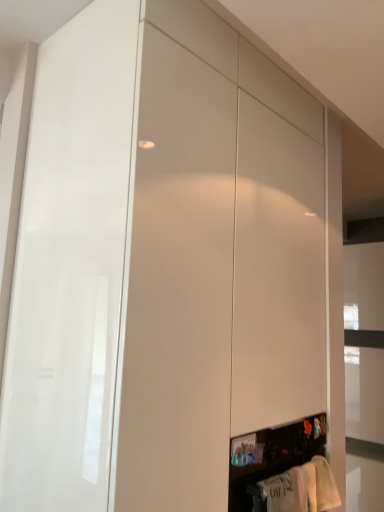
Locate an element on the screen. white cotton shirt at lower right, the first clothing positioned from the front is located at coordinates (286, 490).

Consider the image. Measure the distance between white cotton shirt at lower right, the 2th clothing when ordered from back to front, and camera.

The distance of white cotton shirt at lower right, the 2th clothing when ordered from back to front, from camera is 1.22 meters.

What do you see at coordinates (286, 490) in the screenshot? I see `white cotton shirt at lower right, the first clothing positioned from the front` at bounding box center [286, 490].

The height and width of the screenshot is (512, 384). What are the coordinates of `white cotton towel at lower right, which is the 1th clothing from back to front` in the screenshot? It's located at (325, 485).

The image size is (384, 512). What do you see at coordinates (325, 485) in the screenshot?
I see `white cotton towel at lower right, placed as the 1th clothing when sorted from right to left` at bounding box center [325, 485].

In order to face white cotton towel at lower right, acting as the 2th clothing starting from the left, should I rotate leftwards or rightwards?

Turn right by 16.484 degrees to look at white cotton towel at lower right, acting as the 2th clothing starting from the left.

The width and height of the screenshot is (384, 512). What are the coordinates of `white cotton shirt at lower right, the first clothing in the left-to-right sequence` in the screenshot? It's located at 286,490.

Does white cotton shirt at lower right, the 2th clothing when ordered from back to front, appear on the right side of white cotton towel at lower right, placed as the 1th clothing when sorted from right to left?

No, white cotton shirt at lower right, the 2th clothing when ordered from back to front, is not to the right of white cotton towel at lower right, placed as the 1th clothing when sorted from right to left.

Considering the positions of objects white cotton shirt at lower right, the first clothing positioned from the front, and white cotton towel at lower right, positioned as the 2th clothing in front-to-back order, in the image provided, who is in front, white cotton shirt at lower right, the first clothing positioned from the front, or white cotton towel at lower right, positioned as the 2th clothing in front-to-back order,?

white cotton shirt at lower right, the first clothing positioned from the front, is more forward.

Considering the positions of point (297, 499) and point (323, 481), is point (297, 499) closer or farther from the camera than point (323, 481)?

Point (297, 499) is closer to the camera than point (323, 481).

From the image's perspective, which is above, white cotton shirt at lower right, the 2th clothing when ordered from back to front, or white cotton towel at lower right, placed as the 1th clothing when sorted from right to left?

white cotton shirt at lower right, the 2th clothing when ordered from back to front, appears higher in the image.

From a real-world perspective, which object rests below the other?

white cotton shirt at lower right, the first clothing positioned from the front, from a real-world perspective.

Looking at their sizes, would you say white cotton shirt at lower right, the 2th clothing when ordered from back to front, is wider or thinner than white cotton towel at lower right, which is the 1th clothing from back to front?

In the image, white cotton shirt at lower right, the 2th clothing when ordered from back to front, appears to be wider than white cotton towel at lower right, which is the 1th clothing from back to front.

Does white cotton shirt at lower right, the first clothing in the left-to-right sequence, have a lesser height compared to white cotton towel at lower right, which is the 1th clothing from back to front?

No.

Between white cotton shirt at lower right, the 2th clothing when ordered from back to front, and white cotton towel at lower right, positioned as the 2th clothing in front-to-back order, which one has smaller size?

white cotton towel at lower right, positioned as the 2th clothing in front-to-back order.

Looking at this image, would you say white cotton shirt at lower right, the first clothing in the left-to-right sequence, contains white cotton towel at lower right, positioned as the 2th clothing in front-to-back order?

No, white cotton shirt at lower right, the first clothing in the left-to-right sequence, does not contain white cotton towel at lower right, positioned as the 2th clothing in front-to-back order.

Are white cotton shirt at lower right, which ranks as the second clothing in right-to-left order, and white cotton towel at lower right, which is the 1th clothing from back to front, beside each other?

No.

Is white cotton shirt at lower right, which ranks as the second clothing in right-to-left order, facing towards white cotton towel at lower right, which is the 1th clothing from back to front?

No, white cotton shirt at lower right, which ranks as the second clothing in right-to-left order, does not turn towards white cotton towel at lower right, which is the 1th clothing from back to front.

How different are the orientations of white cotton shirt at lower right, the first clothing positioned from the front, and white cotton towel at lower right, placed as the 1th clothing when sorted from right to left, in degrees?

white cotton shirt at lower right, the first clothing positioned from the front, and white cotton towel at lower right, placed as the 1th clothing when sorted from right to left, are facing 2.72 degrees away from each other.

Could you measure the distance between white cotton shirt at lower right, which ranks as the second clothing in right-to-left order, and white cotton towel at lower right, positioned as the 2th clothing in front-to-back order?

white cotton shirt at lower right, which ranks as the second clothing in right-to-left order, and white cotton towel at lower right, positioned as the 2th clothing in front-to-back order, are 8.95 inches apart from each other.

You are a GUI agent. You are given a task and a screenshot of the screen. Output one action in this format:
    pyautogui.click(x=<x>, y=<y>)
    Task: Click on the clothing to the left of white cotton towel at lower right, acting as the 2th clothing starting from the left
    
    Given the screenshot: What is the action you would take?
    pyautogui.click(x=286, y=490)

Considering the positions of objects white cotton towel at lower right, placed as the 1th clothing when sorted from right to left, and white cotton shirt at lower right, the 2th clothing when ordered from back to front, in the image provided, who is more to the right, white cotton towel at lower right, placed as the 1th clothing when sorted from right to left, or white cotton shirt at lower right, the 2th clothing when ordered from back to front,?

white cotton towel at lower right, placed as the 1th clothing when sorted from right to left, is more to the right.

Who is more distant, white cotton towel at lower right, which is the 1th clothing from back to front, or white cotton shirt at lower right, the 2th clothing when ordered from back to front?

white cotton towel at lower right, which is the 1th clothing from back to front.

Is point (323, 500) closer or farther from the camera than point (268, 500)?

Clearly, point (323, 500) is more distant from the camera than point (268, 500).

From the image's perspective, is white cotton towel at lower right, which is the 1th clothing from back to front, above or below white cotton shirt at lower right, the first clothing positioned from the front?

white cotton towel at lower right, which is the 1th clothing from back to front, is below white cotton shirt at lower right, the first clothing positioned from the front.

From a real-world perspective, is white cotton towel at lower right, positioned as the 2th clothing in front-to-back order, physically above white cotton shirt at lower right, the 2th clothing when ordered from back to front?

Indeed, from a real-world perspective, white cotton towel at lower right, positioned as the 2th clothing in front-to-back order, stands above white cotton shirt at lower right, the 2th clothing when ordered from back to front.

Can you confirm if white cotton towel at lower right, positioned as the 2th clothing in front-to-back order, is wider than white cotton shirt at lower right, the first clothing in the left-to-right sequence?

No.

Considering the sizes of white cotton towel at lower right, which is the 1th clothing from back to front, and white cotton shirt at lower right, the first clothing in the left-to-right sequence, in the image, is white cotton towel at lower right, which is the 1th clothing from back to front, taller or shorter than white cotton shirt at lower right, the first clothing in the left-to-right sequence,?

white cotton towel at lower right, which is the 1th clothing from back to front, is shorter than white cotton shirt at lower right, the first clothing in the left-to-right sequence.

Which of these two, white cotton towel at lower right, acting as the 2th clothing starting from the left, or white cotton shirt at lower right, the first clothing in the left-to-right sequence, is bigger?

white cotton shirt at lower right, the first clothing in the left-to-right sequence, is bigger.

From the picture: Is white cotton shirt at lower right, the 2th clothing when ordered from back to front, surrounded by white cotton towel at lower right, placed as the 1th clothing when sorted from right to left?

No, white cotton shirt at lower right, the 2th clothing when ordered from back to front, is not inside white cotton towel at lower right, placed as the 1th clothing when sorted from right to left.

Is white cotton towel at lower right, positioned as the 2th clothing in front-to-back order, in contact with white cotton shirt at lower right, the first clothing positioned from the front?

No, white cotton towel at lower right, positioned as the 2th clothing in front-to-back order, is not touching white cotton shirt at lower right, the first clothing positioned from the front.

Is white cotton towel at lower right, which is the 1th clothing from back to front, turned away from white cotton shirt at lower right, the first clothing positioned from the front?

No, white cotton towel at lower right, which is the 1th clothing from back to front, is not facing the opposite direction of white cotton shirt at lower right, the first clothing positioned from the front.

How many degrees apart are the facing directions of white cotton towel at lower right, acting as the 2th clothing starting from the left, and white cotton shirt at lower right, the first clothing in the left-to-right sequence?

There is a 2.72-degree angle between the facing directions of white cotton towel at lower right, acting as the 2th clothing starting from the left, and white cotton shirt at lower right, the first clothing in the left-to-right sequence.

How far apart are white cotton towel at lower right, acting as the 2th clothing starting from the left, and white cotton shirt at lower right, the 2th clothing when ordered from back to front?

white cotton towel at lower right, acting as the 2th clothing starting from the left, and white cotton shirt at lower right, the 2th clothing when ordered from back to front, are 8.95 inches apart from each other.

You are a GUI agent. You are given a task and a screenshot of the screen. Output one action in this format:
    pyautogui.click(x=<x>, y=<y>)
    Task: Click on the clothing behind the white cotton shirt at lower right, the first clothing positioned from the front
    Image resolution: width=384 pixels, height=512 pixels.
    Given the screenshot: What is the action you would take?
    pyautogui.click(x=325, y=485)

You are a GUI agent. You are given a task and a screenshot of the screen. Output one action in this format:
    pyautogui.click(x=<x>, y=<y>)
    Task: Click on the clothing in front of the white cotton towel at lower right, which is the 1th clothing from back to front
    This screenshot has width=384, height=512.
    Given the screenshot: What is the action you would take?
    pyautogui.click(x=286, y=490)

Identify the location of clothing that is on the right side of white cotton shirt at lower right, the first clothing in the left-to-right sequence. This screenshot has height=512, width=384. (325, 485).